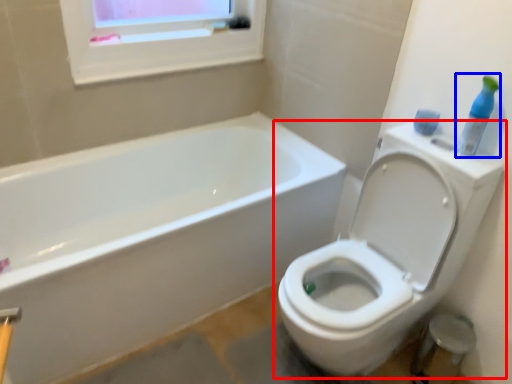
Question: Which of the following is the closest to the observer, toilet (highlighted by a red box) or cleaning product (highlighted by a blue box)?

Choices:
 (A) toilet
 (B) cleaning product

Answer: (A)